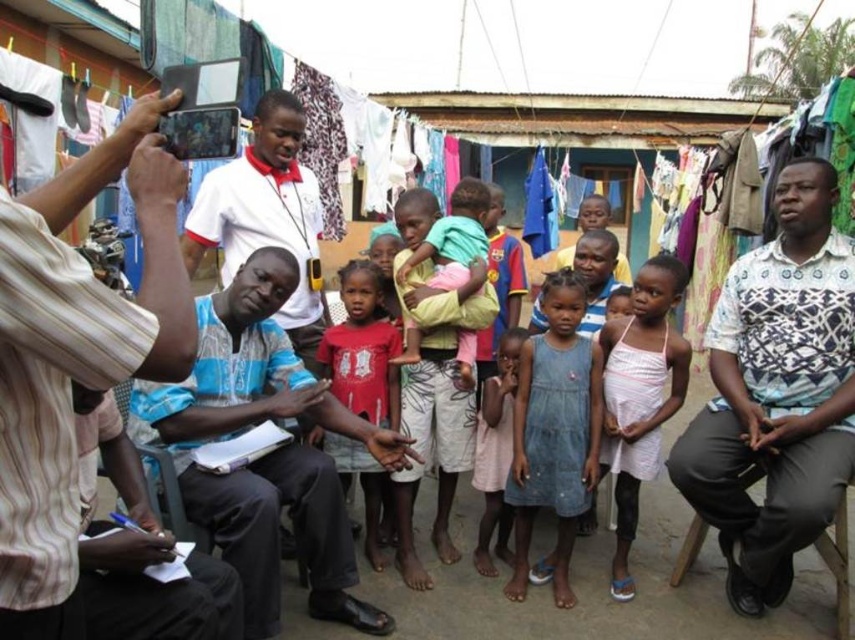
You are a photographer trying to capture a group photo of the striped cotton shirt at left and the denim dress at center. Based on their sizes, which one should you position closer to the camera to ensure both appear equally sized in the photo?

The striped cotton shirt at left is narrower than the denim dress at center. To make them appear the same size in the photo, position the striped cotton shirt at left closer to the camera than the denim dress at center.

You are standing in the residential area and want to take a photo of the striped cotton shirt at left and denim dress at center. Which one should you position closer to the camera to ensure both are in frame?

You should position the striped cotton shirt at left closer to the camera because it is to the left of the denim dress at center, so moving it forward will keep both in frame.